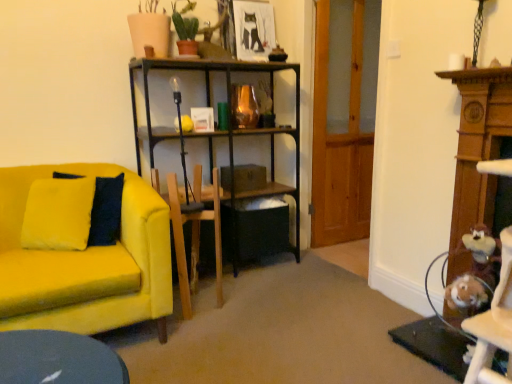
Question: Considering the relative positions of wooden swivel chair at center and transparent wooden door at center in the image provided, is wooden swivel chair at center to the left or to the right of transparent wooden door at center?

Choices:
 (A) left
 (B) right

Answer: (A)

Question: Would you say wooden swivel chair at center is inside or outside transparent wooden door at center?

Choices:
 (A) outside
 (B) inside

Answer: (A)

Question: Which of these objects is positioned closest to the wooden swivel chair at center?

Choices:
 (A) transparent wooden door at center
 (B) velvet yellow couch at left
 (C) matte black picture frame at upper center

Answer: (B)

Question: Which object is the farthest from the wooden swivel chair at center?

Choices:
 (A) velvet yellow couch at left
 (B) transparent wooden door at center
 (C) matte black picture frame at upper center

Answer: (B)